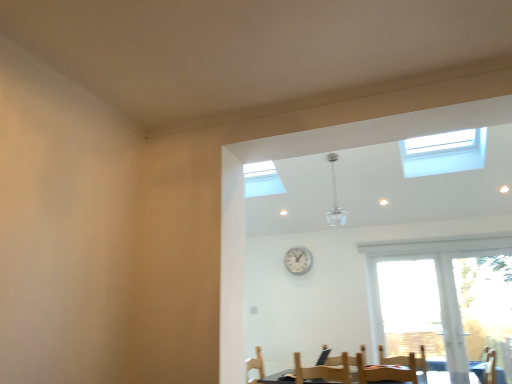
Question: In terms of size, does silver metallic clock at center appear bigger or smaller than wooden armchair at lower right?

Choices:
 (A) small
 (B) big

Answer: (A)

Question: From a real-world perspective, is silver metallic clock at center above or below wooden armchair at lower right?

Choices:
 (A) above
 (B) below

Answer: (A)

Question: Estimate the real-world distances between objects in this image. Which object is closer to the wooden chair at lower center?

Choices:
 (A) wooden armchair at lower right
 (B) silver metallic clock at center

Answer: (A)

Question: Estimate the real-world distances between objects in this image. Which object is farther from the wooden armchair at lower right?

Choices:
 (A) silver metallic clock at center
 (B) wooden chair at lower center

Answer: (A)